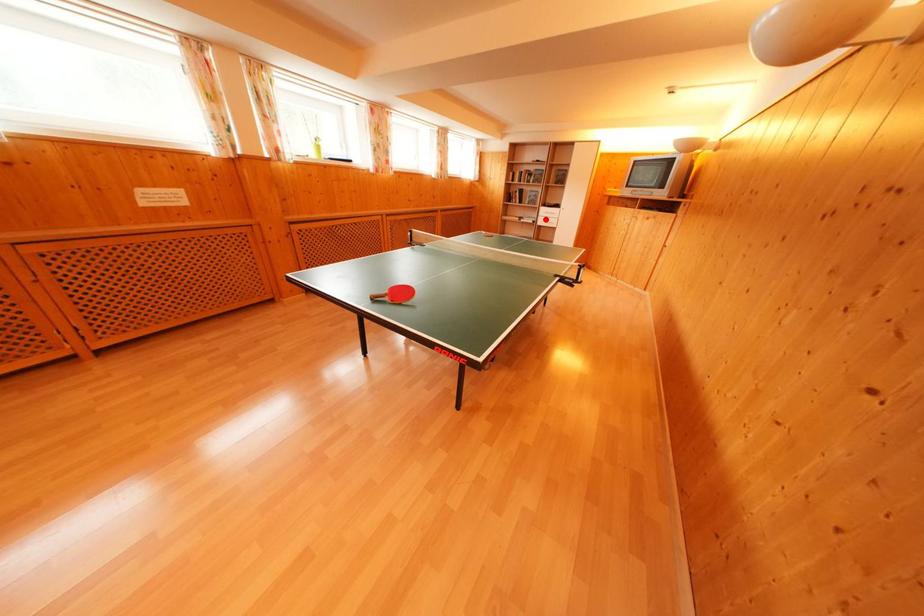
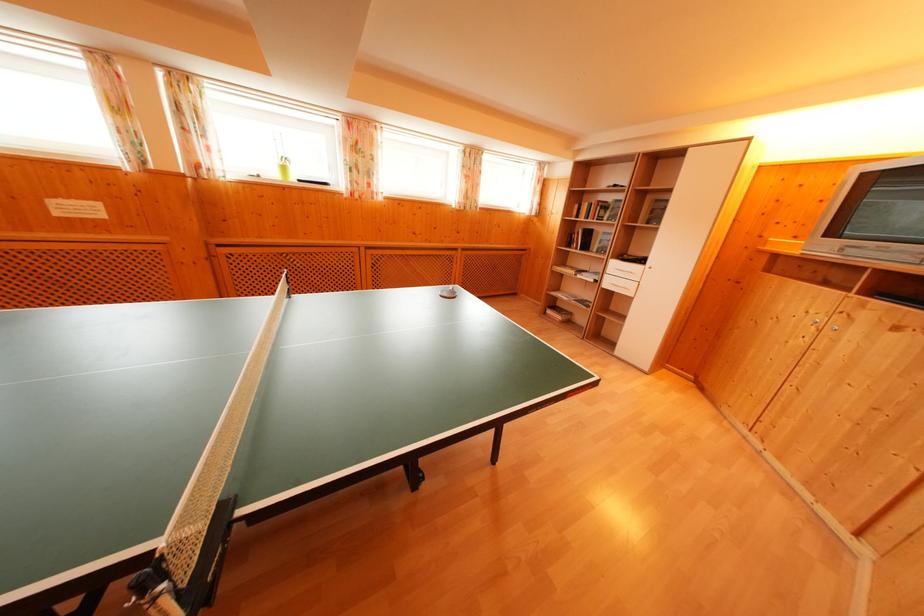
Question: I am providing you with two images of the same scene from different viewpoints. A red point is marked on the first image. Is the red point's position out of view in image 2?

Choices:
 (A) Yes
 (B) No

Answer: (B)